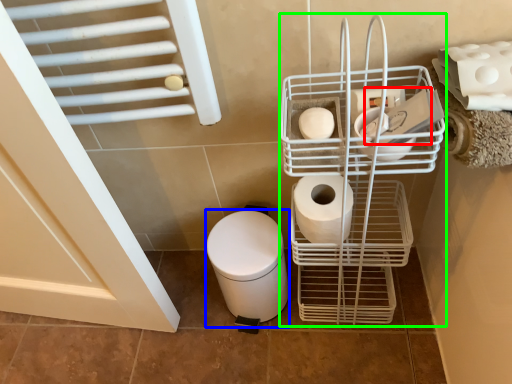
Question: Considering the real-world distances, which object is farthest from toilet paper (highlighted by a red box)? toilet bowl (highlighted by a blue box) or shopping cart (highlighted by a green box)?

Choices:
 (A) toilet bowl
 (B) shopping cart

Answer: (A)